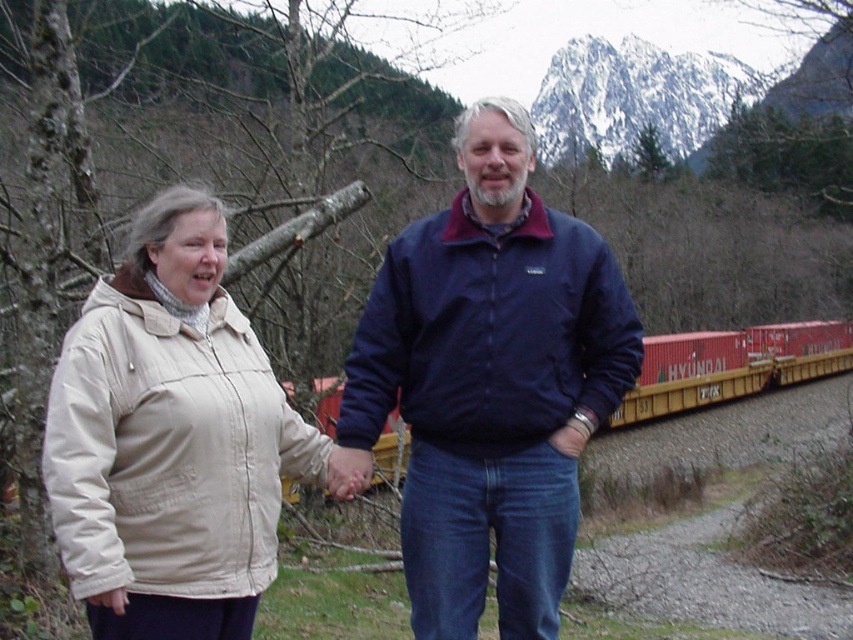
You are a photographer trying to capture a photo of the beige fabric jacket at left and the red matte train car at right. Given their sizes, which object should you focus on first to ensure both are in frame?

The beige fabric jacket at left is smaller than the red matte train car at right, so you should focus on the beige fabric jacket at left first to ensure both fit within the frame.

Consider the image. You are standing at the scene described and want to cross the train track safely. The navy blue jacket at center and the red matte train car at right are in your path. Which object should you avoid first to ensure safety?

The navy blue jacket at center is to the left of the red matte train car at right. Since the train car is moving towards the right, you should first avoid the red matte train car at right as it is closer to your path and poses an immediate danger.

You are a photographer trying to capture a photo of the navy blue jacket at center and the beige fabric jacket at left. Based on their positions, which jacket should you focus on first to ensure both are in frame?

The navy blue jacket at center is located above the beige fabric jacket at left, so you should focus on the navy blue jacket at center first to ensure both are in frame.